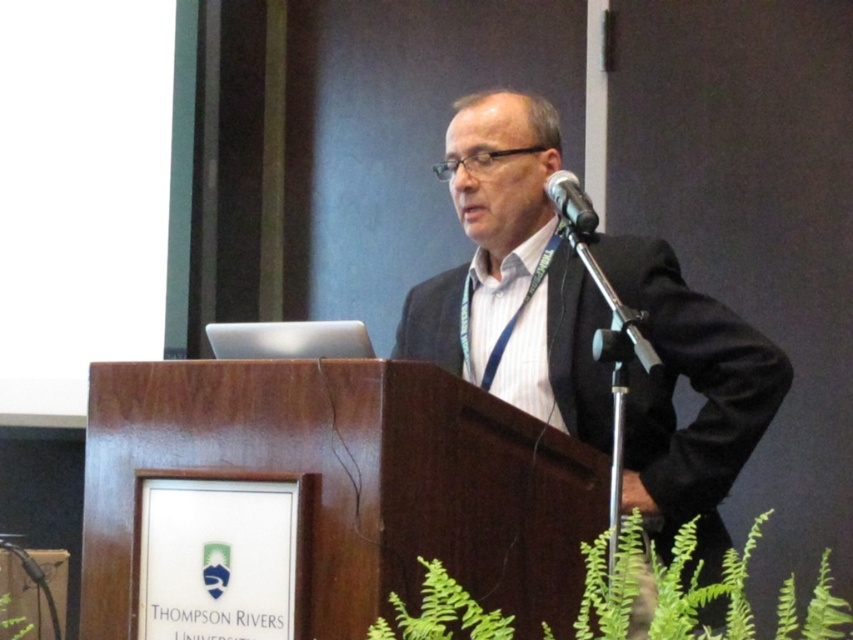
Question: Can you confirm if black suit at center is bigger than black metallic microphone at upper center?

Choices:
 (A) no
 (B) yes

Answer: (B)

Question: Is black suit at center further to the viewer compared to black metallic microphone at upper center?

Choices:
 (A) no
 (B) yes

Answer: (A)

Question: Which of the following is the farthest from the observer?

Choices:
 (A) pos(573,365)
 (B) pos(593,225)

Answer: (A)

Question: Among these objects, which one is farthest from the camera?

Choices:
 (A) black suit at center
 (B) black metallic microphone at upper center

Answer: (B)

Question: Which point is closer to the camera?

Choices:
 (A) (564, 211)
 (B) (490, 99)

Answer: (A)

Question: Is the position of black suit at center less distant than that of black metallic microphone at upper center?

Choices:
 (A) no
 (B) yes

Answer: (B)